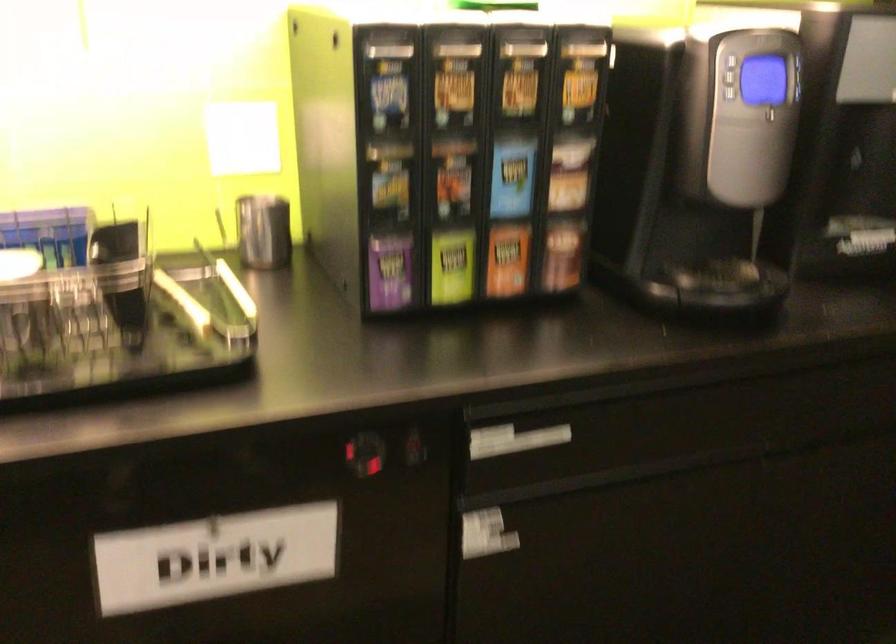
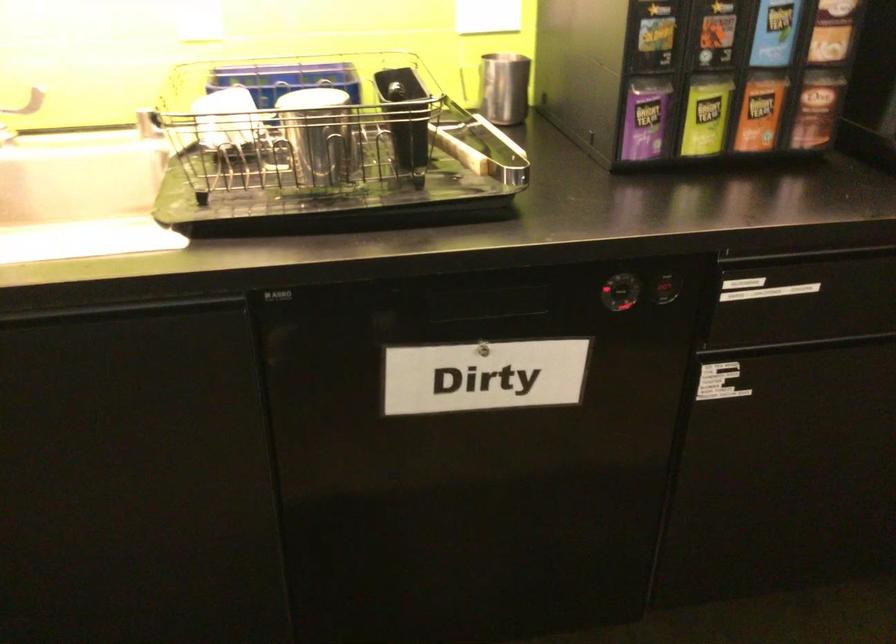
Locate, in the second image, the point that corresponds to point (561, 252) in the first image.

(816, 109)